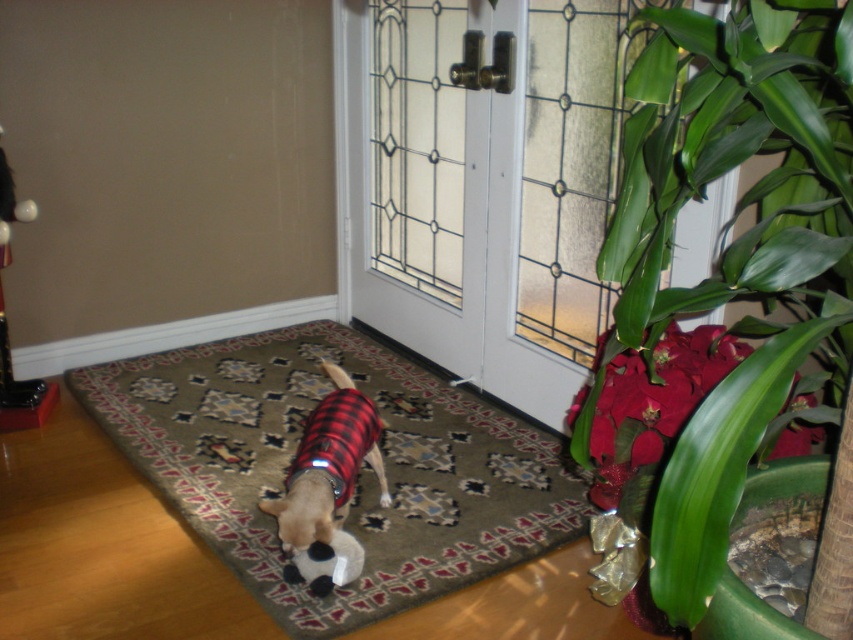
Does carpeted rug at center have a greater height compared to metallic silver figurine at left?

No, carpeted rug at center is not taller than metallic silver figurine at left.

Based on the photo, how distant is carpeted rug at center from metallic silver figurine at left?

32.65 inches

Is point (549, 477) farther from viewer compared to point (7, 420)?

That is False.

What are the coordinates of `carpeted rug at center` in the screenshot? It's located at (360, 472).

Can you confirm if green leafy plant at right is smaller than plaid fabric dog at center?

No, green leafy plant at right is not smaller than plaid fabric dog at center.

Between point (715, 516) and point (331, 515), which one is positioned behind?

The point (331, 515) is more distant.

Which is behind, point (657, 104) or point (305, 556)?

Point (305, 556)

This screenshot has height=640, width=853. In order to click on green leafy plant at right in this screenshot , I will do `click(727, 288)`.

Between green leafy plant at right and metallic silver figurine at left, which one appears on the right side from the viewer's perspective?

From the viewer's perspective, green leafy plant at right appears more on the right side.

Can you confirm if green leafy plant at right is positioned to the right of metallic silver figurine at left?

Indeed, green leafy plant at right is positioned on the right side of metallic silver figurine at left.

The image size is (853, 640). Describe the element at coordinates (727, 288) in the screenshot. I see `green leafy plant at right` at that location.

Where is `green leafy plant at right`? green leafy plant at right is located at coordinates (727, 288).